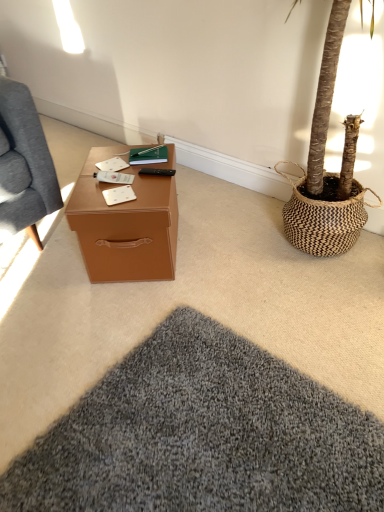
Where is `blank space above brown leather desk at center (from a real-world perspective)`? Image resolution: width=384 pixels, height=512 pixels. blank space above brown leather desk at center (from a real-world perspective) is located at coordinates (121, 178).